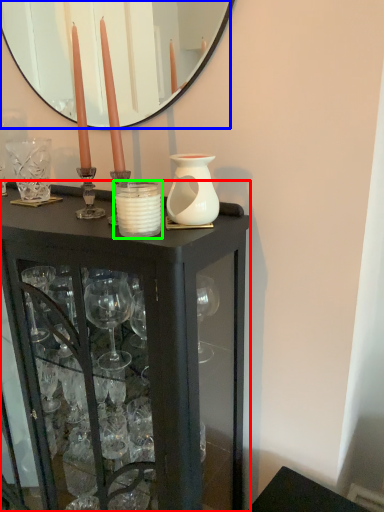
Question: Which is nearer to the table (highlighted by a red box)? mirror (highlighted by a blue box) or candle holder (highlighted by a green box).

Choices:
 (A) mirror
 (B) candle holder

Answer: (B)